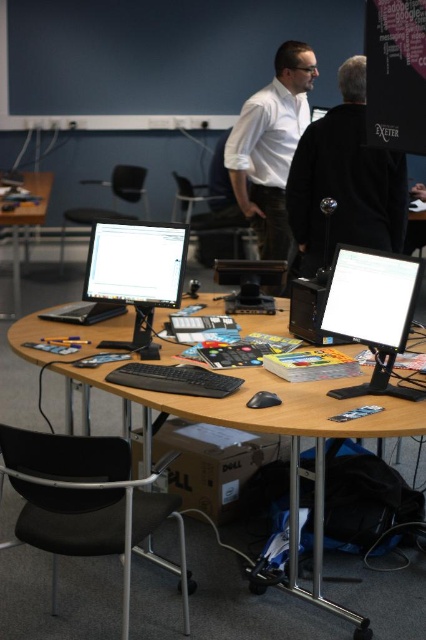
Question: Which object appears closest to the camera in this image?

Choices:
 (A) black plastic chair at lower left
 (B) wooden table at center
 (C) white matte shirt at upper center
 (D) matte black monitor at right

Answer: (A)

Question: Does wooden at center have a larger size compared to black plastic chair at center?

Choices:
 (A) no
 (B) yes

Answer: (A)

Question: Which point is farther to the camera?

Choices:
 (A) (126, 189)
 (B) (412, 300)
 (C) (196, 557)

Answer: (A)

Question: Is wooden at center thinner than black matte jacket at upper center?

Choices:
 (A) no
 (B) yes

Answer: (A)

Question: Which point is closer to the camera?

Choices:
 (A) (357, 173)
 (B) (108, 234)
 (C) (354, 323)
 (D) (77, 536)

Answer: (D)

Question: Is matte black monitor at right in front of wooden table at center?

Choices:
 (A) yes
 (B) no

Answer: (A)